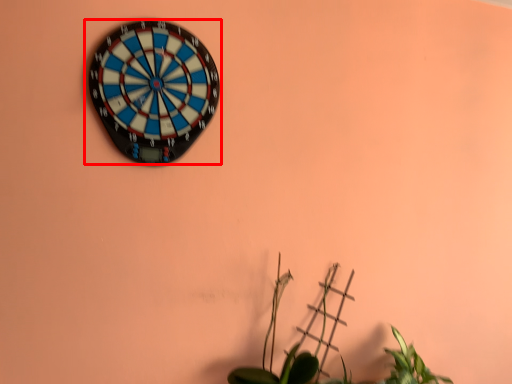
Question: From the image's perspective, considering the relative positions of wall clock (annotated by the red box) and houseplant in the image provided, where is wall clock (annotated by the red box) located with respect to the staircase?

Choices:
 (A) above
 (B) below

Answer: (A)